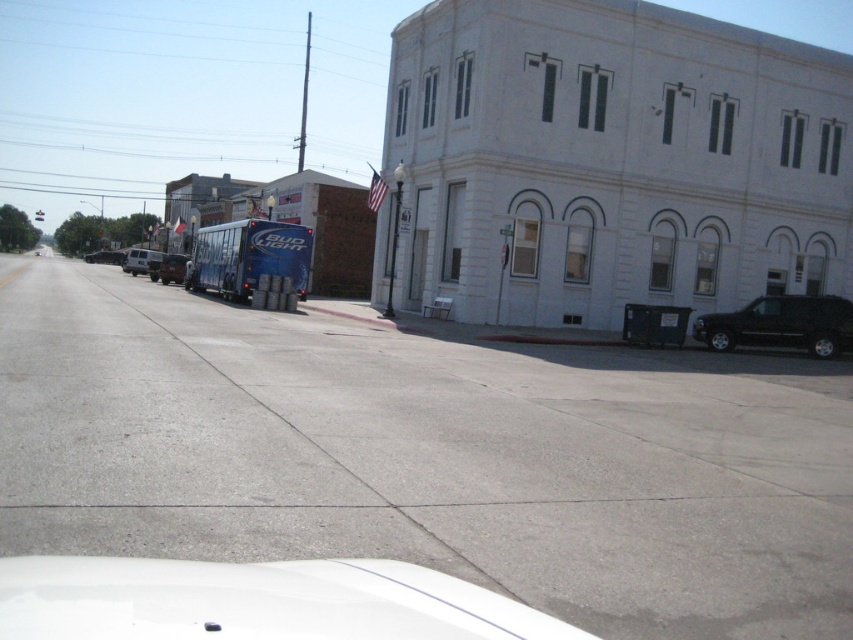
Question: Is silver metallic van at left to the right of metallic silver van at center-left from the viewer's perspective?

Choices:
 (A) no
 (B) yes

Answer: (A)

Question: Which point is closer to the camera taking this photo?

Choices:
 (A) (403, 275)
 (B) (181, 282)
 (C) (96, 253)
 (D) (733, 339)

Answer: (D)

Question: Which of the following is the farthest from the observer?

Choices:
 (A) (799, 333)
 (B) (148, 259)
 (C) (125, 257)

Answer: (C)

Question: Does black matte suv at lower right appear on the left side of silver metallic van at left?

Choices:
 (A) no
 (B) yes

Answer: (A)

Question: Which object appears farthest from the camera in this image?

Choices:
 (A) black matte suv at lower right
 (B) metallic silver van at center-left
 (C) white glossy car at lower center
 (D) white stone building at upper right

Answer: (B)

Question: Is white stone building at upper right wider than black matte suv at lower right?

Choices:
 (A) no
 (B) yes

Answer: (B)